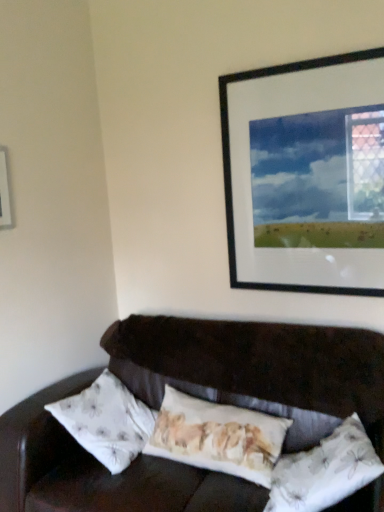
Question: Can you confirm if floral fabric pillow at center, which is counted as the 1th pillow, starting from the left, is positioned to the right of black matte picture frame at upper right, which ranks as the second picture frame in left-to-right order?

Choices:
 (A) yes
 (B) no

Answer: (B)

Question: Are floral fabric pillow at center, which is counted as the 1th pillow, starting from the left, and black matte picture frame at upper right, marked as the first picture frame in a right-to-left arrangement, located far from each other?

Choices:
 (A) yes
 (B) no

Answer: (B)

Question: Could black matte picture frame at upper right, which ranks as the second picture frame in left-to-right order, be considered to be inside floral fabric pillow at center, positioned as the 2th pillow in right-to-left order?

Choices:
 (A) yes
 (B) no

Answer: (B)

Question: Could you tell me if floral fabric pillow at center, positioned as the 2th pillow in right-to-left order, is facing black matte picture frame at upper right, marked as the first picture frame in a right-to-left arrangement?

Choices:
 (A) no
 (B) yes

Answer: (A)

Question: Does floral fabric pillow at center, which is counted as the 1th pillow, starting from the left, have a greater height compared to black matte picture frame at upper right, marked as the first picture frame in a right-to-left arrangement?

Choices:
 (A) no
 (B) yes

Answer: (A)

Question: Looking at their shapes, would you say white floral fabric pillow at lower right, the 2th pillow when ordered from left to right, is wider or thinner than white plastic picture frame at upper left, placed as the second picture frame when sorted from right to left?

Choices:
 (A) thin
 (B) wide

Answer: (B)

Question: Considering the positions of point (349, 470) and point (3, 211), is point (349, 470) closer or farther from the camera than point (3, 211)?

Choices:
 (A) closer
 (B) farther

Answer: (A)

Question: Is white floral fabric pillow at lower right, the 2th pillow when ordered from left to right, bigger or smaller than white plastic picture frame at upper left, placed as the second picture frame when sorted from right to left?

Choices:
 (A) small
 (B) big

Answer: (B)

Question: From the image's perspective, is white floral fabric pillow at lower right, the 2th pillow when ordered from left to right, located above or below white plastic picture frame at upper left, placed as the second picture frame when sorted from right to left?

Choices:
 (A) below
 (B) above

Answer: (A)

Question: From the image's perspective, is white plastic picture frame at upper left, placed as the second picture frame when sorted from right to left, above or below floral fabric pillow at center, positioned as the 2th pillow in right-to-left order?

Choices:
 (A) below
 (B) above

Answer: (B)

Question: From a real-world perspective, is white plastic picture frame at upper left, the 1th picture frame from the left, positioned above or below floral fabric pillow at center, which is counted as the 1th pillow, starting from the left?

Choices:
 (A) above
 (B) below

Answer: (A)

Question: Is white plastic picture frame at upper left, placed as the second picture frame when sorted from right to left, bigger or smaller than floral fabric pillow at center, which is counted as the 1th pillow, starting from the left?

Choices:
 (A) small
 (B) big

Answer: (A)

Question: Do you think white plastic picture frame at upper left, the 1th picture frame from the left, is within floral fabric pillow at center, which is counted as the 1th pillow, starting from the left, or outside of it?

Choices:
 (A) outside
 (B) inside

Answer: (A)

Question: Considering the positions of point click(x=246, y=470) and point click(x=367, y=437), is point click(x=246, y=470) closer or farther from the camera than point click(x=367, y=437)?

Choices:
 (A) farther
 (B) closer

Answer: (A)

Question: From a real-world perspective, is floral fabric pillow at center, positioned as the 2th pillow in right-to-left order, positioned above or below white floral fabric pillow at lower right, the 2th pillow when ordered from left to right?

Choices:
 (A) above
 (B) below

Answer: (A)